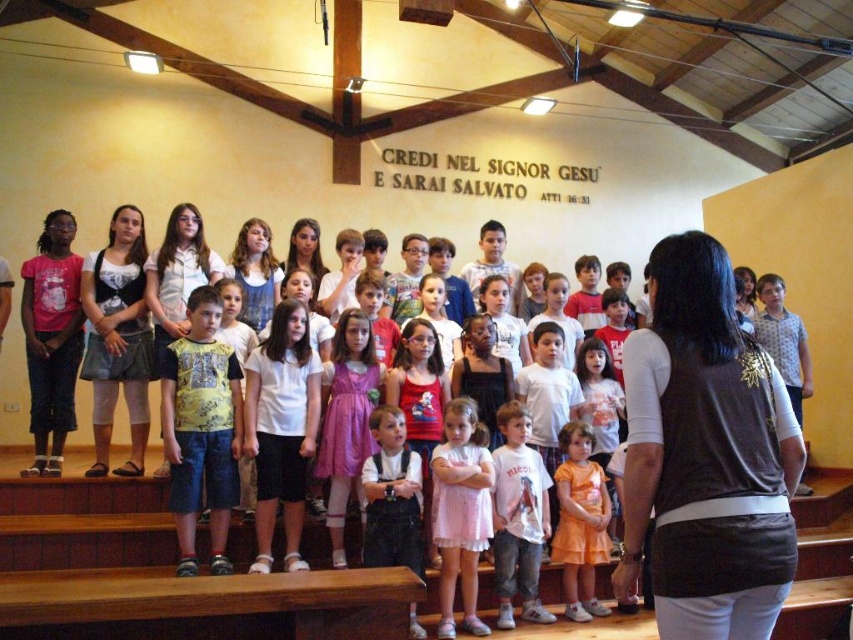
Question: Which point is closer to the camera taking this photo?

Choices:
 (A) (437, 486)
 (B) (587, 525)

Answer: (A)

Question: Can you confirm if yellow printed t-shirt at center is positioned to the left of orange satin dress at center?

Choices:
 (A) no
 (B) yes

Answer: (B)

Question: Which of the following is the farthest from the observer?

Choices:
 (A) yellow printed t-shirt at center
 (B) orange satin dress at center
 (C) pink cotton dress at center

Answer: (B)

Question: Is the position of pink cotton dress at center less distant than that of orange satin dress at center?

Choices:
 (A) no
 (B) yes

Answer: (B)

Question: Is yellow printed t-shirt at center positioned in front of orange satin dress at center?

Choices:
 (A) yes
 (B) no

Answer: (A)

Question: Which point is closer to the camera?

Choices:
 (A) (218, 492)
 (B) (566, 426)

Answer: (A)